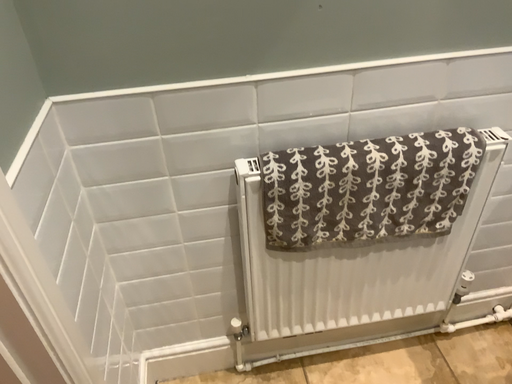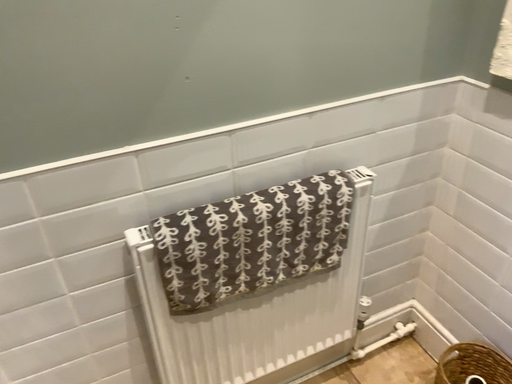
Question: How did the camera likely rotate when shooting the video?

Choices:
 (A) rotated upward
 (B) rotated downward

Answer: (A)